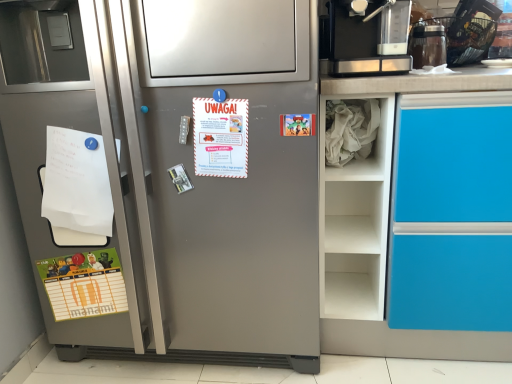
Image resolution: width=512 pixels, height=384 pixels. Describe the element at coordinates (84, 284) in the screenshot. I see `green matte poster at lower left, which ranks as the first postcard in back-to-front order` at that location.

Describe the element at coordinates (356, 43) in the screenshot. Image resolution: width=512 pixels, height=384 pixels. I see `black plastic coffee machine at upper right` at that location.

I want to click on white paper at left, so click(76, 188).

I want to click on satin silver refrigerator at left, so click(x=190, y=180).

Is green matte poster at lower left, which appears as the third postcard when viewed from the right, wider or thinner than black plastic coffee machine at upper right?

In the image, green matte poster at lower left, which appears as the third postcard when viewed from the right, appears to be more narrow than black plastic coffee machine at upper right.

Is point (95, 302) more distant than point (383, 0)?

That is True.

From the image's perspective, would you say green matte poster at lower left, the 1th postcard from the left, is shown under black plastic coffee machine at upper right?

Correct, green matte poster at lower left, the 1th postcard from the left, appears lower than black plastic coffee machine at upper right in the image.

Which object is closer to the camera, cartoon paper at upper right, which appears as the third postcard when viewed from the left, or green matte poster at lower left, which appears as the third postcard when viewed from the right?

cartoon paper at upper right, which appears as the third postcard when viewed from the left, is in front.

Is cartoon paper at upper right, the first postcard when ordered from top to bottom, located outside green matte poster at lower left, which appears as the third postcard when viewed from the right?

That's correct, cartoon paper at upper right, the first postcard when ordered from top to bottom, is outside of green matte poster at lower left, which appears as the third postcard when viewed from the right.

Is cartoon paper at upper right, the 2th postcard viewed from the back, touching green matte poster at lower left, the 3th postcard in the front-to-back sequence?

No, cartoon paper at upper right, the 2th postcard viewed from the back, is not beside green matte poster at lower left, the 3th postcard in the front-to-back sequence.

Which of these two, cartoon paper at upper right, the first postcard positioned from the right, or green matte poster at lower left, the 1th postcard from the left, is wider?

Wider between the two is green matte poster at lower left, the 1th postcard from the left.

Which is closer, (421, 26) or (45, 281)?

The point (45, 281) is closer.

Is transparent plastic container at upper right, the first appliance viewed from the left, not close to green matte poster at lower left, the 3th postcard in the front-to-back sequence?

Yes, transparent plastic container at upper right, the first appliance viewed from the left, and green matte poster at lower left, the 3th postcard in the front-to-back sequence, are quite far apart.

Consider the image. Who is shorter, transparent plastic container at upper right, the first appliance viewed from the left, or green matte poster at lower left, the 3th postcard in the front-to-back sequence?

With less height is transparent plastic container at upper right, the first appliance viewed from the left.

How different are the orientations of transparent plastic container at upper right, the first appliance viewed from the left, and white paper at center, the 1th postcard viewed from the front, in degrees?

7.56 degrees.

Is transparent plastic container at upper right, the first appliance viewed from the left, directly adjacent to white paper at center, the 1th postcard viewed from the front?

transparent plastic container at upper right, the first appliance viewed from the left, and white paper at center, the 1th postcard viewed from the front, are not in contact.

From the image's perspective, is transparent plastic container at upper right, acting as the second appliance starting from the right, below white paper at center, the 1th postcard viewed from the front?

No, from the image's perspective, transparent plastic container at upper right, acting as the second appliance starting from the right, is not below white paper at center, the 1th postcard viewed from the front.

Who is bigger, transparent plastic container at upper right, the first appliance viewed from the left, or white paper at center, which is the 2th postcard in bottom-to-top order?

transparent plastic container at upper right, the first appliance viewed from the left.

Is white paper at center, which is the 2th postcard in bottom-to-top order, aimed at black plastic coffee machine at upper right?

No, white paper at center, which is the 2th postcard in bottom-to-top order, is not turned towards black plastic coffee machine at upper right.

Who is taller, white paper at center, which ranks as the second postcard in top-to-bottom order, or black plastic coffee machine at upper right?

white paper at center, which ranks as the second postcard in top-to-bottom order, is taller.

From a real-world perspective, which is physically above, white paper at center, which is the 2th postcard in bottom-to-top order, or black plastic coffee machine at upper right?

From a 3D spatial view, black plastic coffee machine at upper right is above.

Between point (228, 142) and point (408, 70), which one is positioned in front?

Point (408, 70)

Is cartoon paper at upper right, which appears as the third postcard when viewed from the left, turned away from black plastic basket at upper right, which appears as the 2th appliance when viewed from the left?

No, black plastic basket at upper right, which appears as the 2th appliance when viewed from the left, is not at the back of cartoon paper at upper right, which appears as the third postcard when viewed from the left.

Does cartoon paper at upper right, which appears as the third postcard when viewed from the left, touch black plastic basket at upper right, which appears as the 2th appliance when viewed from the left?

There is a gap between cartoon paper at upper right, which appears as the third postcard when viewed from the left, and black plastic basket at upper right, which appears as the 2th appliance when viewed from the left.

Is cartoon paper at upper right, the 2th postcard viewed from the back, inside the boundaries of black plastic basket at upper right, which appears as the 2th appliance when viewed from the left, or outside?

cartoon paper at upper right, the 2th postcard viewed from the back, exists outside the volume of black plastic basket at upper right, which appears as the 2th appliance when viewed from the left.

Who is taller, cartoon paper at upper right, which appears as the 3th postcard when ordered from the bottom, or black plastic basket at upper right, which appears as the 2th appliance when viewed from the left?

black plastic basket at upper right, which appears as the 2th appliance when viewed from the left, is taller.

In terms of height, does white crumpled paper at right look taller or shorter compared to satin silver refrigerator at left?

white crumpled paper at right is shorter than satin silver refrigerator at left.

From the image's perspective, which one is positioned higher, white crumpled paper at right or satin silver refrigerator at left?

white crumpled paper at right appears higher in the image.

Is white crumpled paper at right inside the boundaries of satin silver refrigerator at left, or outside?

white crumpled paper at right is located beyond the bounds of satin silver refrigerator at left.

Which is in front, white crumpled paper at right or satin silver refrigerator at left?

Positioned in front is satin silver refrigerator at left.

From a real-world perspective, which postcard is the 3rd one underneath the black plastic coffee machine at upper right? Please provide its 2D coordinates.

[(84, 284)]

You are a GUI agent. You are given a task and a screenshot of the screen. Output one action in this format:
    pyautogui.click(x=<x>, y=<y>)
    Task: Click on the 2nd postcard above the green matte poster at lower left, acting as the first postcard starting from the bottom (from the image's perspective)
    The width and height of the screenshot is (512, 384).
    Given the screenshot: What is the action you would take?
    pyautogui.click(x=298, y=125)

Based on their spatial positions, is satin silver refrigerator at left or green matte poster at lower left, which ranks as the first postcard in back-to-front order, further from black plastic basket at upper right, which is counted as the 1th appliance, starting from the right?

green matte poster at lower left, which ranks as the first postcard in back-to-front order, lies further to black plastic basket at upper right, which is counted as the 1th appliance, starting from the right, than the other object.

From the image, which object appears to be nearer to transparent plastic container at upper right, the first appliance viewed from the left, black plastic coffee machine at upper right or white crumpled paper at right?

The object closer to transparent plastic container at upper right, the first appliance viewed from the left, is black plastic coffee machine at upper right.

Which object lies nearer to the anchor point white paper at left, satin silver refrigerator at left or black plastic basket at upper right, which appears as the 2th appliance when viewed from the left?

The object closer to white paper at left is satin silver refrigerator at left.

Considering their positions, is green matte poster at lower left, which appears as the third postcard when viewed from the right, positioned closer to cartoon paper at upper right, the 2th postcard viewed from the back, than white paper at center, arranged as the 2th postcard when viewed from the left?

white paper at center, arranged as the 2th postcard when viewed from the left, lies closer to cartoon paper at upper right, the 2th postcard viewed from the back, than the other object.

When comparing their distances from satin silver refrigerator at left, does green matte poster at lower left, which ranks as the first postcard in back-to-front order, or black plastic basket at upper right, which appears as the 2th appliance when viewed from the left, seem closer?

The object closer to satin silver refrigerator at left is green matte poster at lower left, which ranks as the first postcard in back-to-front order.

Considering their positions, is black plastic basket at upper right, which is counted as the 1th appliance, starting from the right, positioned further to transparent plastic container at upper right, acting as the second appliance starting from the right, than white crumpled paper at right?

Among the two, white crumpled paper at right is located further to transparent plastic container at upper right, acting as the second appliance starting from the right.

Looking at the image, which one is located further to satin silver refrigerator at left, cartoon paper at upper right, the first postcard when ordered from top to bottom, or green matte poster at lower left, which ranks as the first postcard in back-to-front order?

Based on the image, cartoon paper at upper right, the first postcard when ordered from top to bottom, appears to be further to satin silver refrigerator at left.

Consider the image. Based on their spatial positions, is black plastic coffee machine at upper right or satin silver refrigerator at left closer to white crumpled paper at right?

black plastic coffee machine at upper right is closer to white crumpled paper at right.

Identify the location of cabinet between white paper at left and transparent plastic container at upper right, the first appliance viewed from the left, in the horizontal direction. The image size is (512, 384). point(358,137).

Where is `cabinet located between green matte poster at lower left, the 3th postcard in the front-to-back sequence, and transparent plastic container at upper right, acting as the second appliance starting from the right, in the left-right direction`? This screenshot has height=384, width=512. cabinet located between green matte poster at lower left, the 3th postcard in the front-to-back sequence, and transparent plastic container at upper right, acting as the second appliance starting from the right, in the left-right direction is located at coordinates click(358, 137).

At what (x,y) coordinates should I click in order to perform the action: click on flyer between green matte poster at lower left, which appears as the 3th postcard when viewed from the top, and white crumpled paper at right from left to right. Please return your answer as a coordinate pair (x, y). Looking at the image, I should click on pyautogui.click(x=76, y=188).

Where is `appliance between white paper at center, arranged as the 2th postcard when viewed from the left, and black plastic basket at upper right, which is counted as the 1th appliance, starting from the right, in the horizontal direction`? Image resolution: width=512 pixels, height=384 pixels. appliance between white paper at center, arranged as the 2th postcard when viewed from the left, and black plastic basket at upper right, which is counted as the 1th appliance, starting from the right, in the horizontal direction is located at coordinates (428, 45).